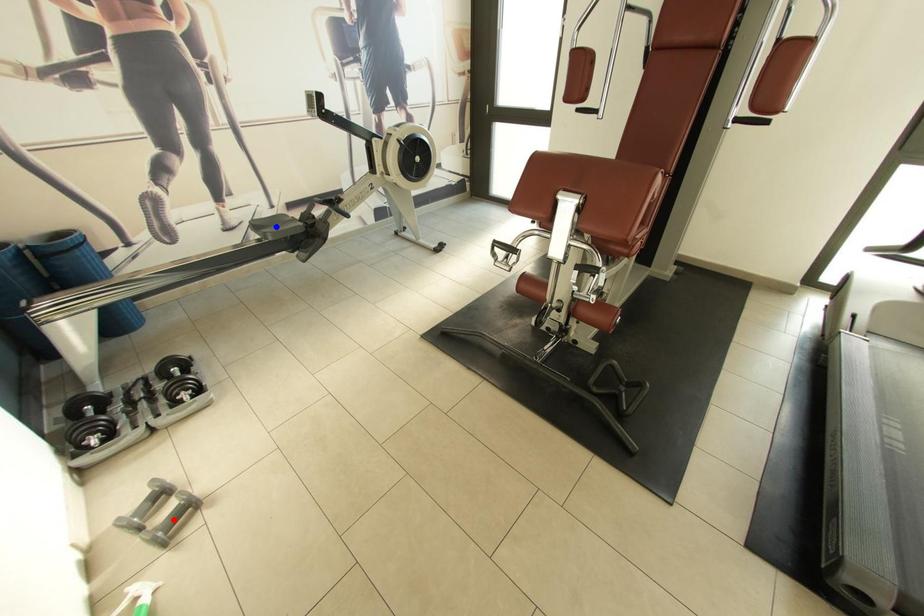
Question: Two points are marked on the image. Which point is closer to the camera?

Choices:
 (A) Blue point is closer.
 (B) Red point is closer.

Answer: (B)